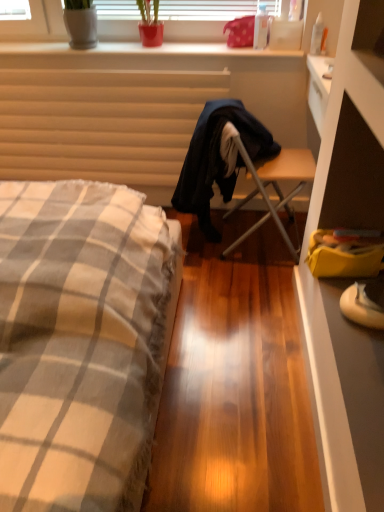
Where is `green matte plant at upper center`? green matte plant at upper center is located at coordinates (206, 9).

Locate an element on the screen. yellow fabric bag at lower right is located at coordinates (344, 255).

The width and height of the screenshot is (384, 512). I want to click on transparent plastic bottle at upper right, marked as the first bottle in a right-to-left arrangement, so click(x=317, y=35).

Find the location of a particular element. The image size is (384, 512). transparent plastic bottle at upper center, the second bottle viewed from the right is located at coordinates (261, 27).

The height and width of the screenshot is (512, 384). What do you see at coordinates (273, 186) in the screenshot?
I see `wooden folding chair at center` at bounding box center [273, 186].

Describe the element at coordinates (364, 304) in the screenshot. This screenshot has height=512, width=384. I see `white suede sneakers at lower right` at that location.

The height and width of the screenshot is (512, 384). In order to click on green matte plant at upper center in this screenshot , I will do `click(206, 9)`.

From a real-world perspective, is green matte plant at upper center positioned above or below transparent plastic bottle at upper right, positioned as the second bottle in left-to-right order?

Clearly, from a real-world perspective, green matte plant at upper center is above transparent plastic bottle at upper right, positioned as the second bottle in left-to-right order.

From the image's perspective, does green matte plant at upper center appear lower than transparent plastic bottle at upper right, positioned as the second bottle in left-to-right order?

No, from the image's perspective, green matte plant at upper center is not beneath transparent plastic bottle at upper right, positioned as the second bottle in left-to-right order.

Who is shorter, green matte plant at upper center or transparent plastic bottle at upper right, marked as the first bottle in a right-to-left arrangement?

With less height is green matte plant at upper center.

From a real-world perspective, which bottle is the 2nd one underneath the green matte plant at upper center? Please provide its 2D coordinates.

[(317, 35)]

Choose the correct answer: Is transparent plastic bottle at upper right, positioned as the second bottle in left-to-right order, inside dark blue fabric robe at center or outside it?

The correct answer is: outside.

Who is smaller, transparent plastic bottle at upper right, marked as the first bottle in a right-to-left arrangement, or dark blue fabric robe at center?

Smaller between the two is transparent plastic bottle at upper right, marked as the first bottle in a right-to-left arrangement.

Considering the relative sizes of transparent plastic bottle at upper right, marked as the first bottle in a right-to-left arrangement, and dark blue fabric robe at center in the image provided, is transparent plastic bottle at upper right, marked as the first bottle in a right-to-left arrangement, shorter than dark blue fabric robe at center?

Yes, transparent plastic bottle at upper right, marked as the first bottle in a right-to-left arrangement, is shorter than dark blue fabric robe at center.

Can you tell me how much transparent plastic bottle at upper right, positioned as the second bottle in left-to-right order, and dark blue fabric robe at center differ in facing direction?

There is a 180-degree angle between the facing directions of transparent plastic bottle at upper right, positioned as the second bottle in left-to-right order, and dark blue fabric robe at center.

How far apart are dark blue fabric robe at center and checkered fabric bed at left?

A distance of 30.01 inches exists between dark blue fabric robe at center and checkered fabric bed at left.

Considering the relative positions of dark blue fabric robe at center and checkered fabric bed at left in the image provided, is dark blue fabric robe at center in front of checkered fabric bed at left?

No, the depth of dark blue fabric robe at center is greater than that of checkered fabric bed at left.

From a real-world perspective, is dark blue fabric robe at center physically below checkered fabric bed at left?

Yes, from a real-world perspective, dark blue fabric robe at center is under checkered fabric bed at left.

Could you tell me if dark blue fabric robe at center is facing checkered fabric bed at left?

No.

Is yellow fabric bag at lower right facing away from transparent plastic bottle at upper center, which appears as the 1th bottle when viewed from the left?

No, yellow fabric bag at lower right is not facing the opposite direction of transparent plastic bottle at upper center, which appears as the 1th bottle when viewed from the left.

Which is in front, yellow fabric bag at lower right or transparent plastic bottle at upper center, the second bottle viewed from the right?

yellow fabric bag at lower right is in front.

From the image's perspective, which is above, yellow fabric bag at lower right or transparent plastic bottle at upper center, which appears as the 1th bottle when viewed from the left?

transparent plastic bottle at upper center, which appears as the 1th bottle when viewed from the left, from the image's perspective.

Is yellow fabric bag at lower right placed right next to transparent plastic bottle at upper center, the second bottle viewed from the right?

No, yellow fabric bag at lower right is not in contact with transparent plastic bottle at upper center, the second bottle viewed from the right.

At what (x,y) coordinates should I click in order to perform the action: click on chair that appears below the green matte plant at upper center (from a real-world perspective). Please return your answer as a coordinate pair (x, y). The height and width of the screenshot is (512, 384). Looking at the image, I should click on (273, 186).

Based on the photo, is the surface of green matte plant at upper center in direct contact with wooden folding chair at center?

No, green matte plant at upper center is not making contact with wooden folding chair at center.

Does green matte plant at upper center appear on the right side of wooden folding chair at center?

No, green matte plant at upper center is not to the right of wooden folding chair at center.

From their relative heights in the image, would you say green matte plant at upper center is taller or shorter than wooden folding chair at center?

green matte plant at upper center is shorter than wooden folding chair at center.

Can you tell me how much transparent plastic bottle at upper right, positioned as the second bottle in left-to-right order, and wooden folding chair at center differ in facing direction?

transparent plastic bottle at upper right, positioned as the second bottle in left-to-right order, and wooden folding chair at center are facing 180 degrees away from each other.

In the scene shown: Is transparent plastic bottle at upper right, positioned as the second bottle in left-to-right order, directly adjacent to wooden folding chair at center?

No.

From the image's perspective, is transparent plastic bottle at upper right, positioned as the second bottle in left-to-right order, on wooden folding chair at center?

Indeed, from the image's perspective, transparent plastic bottle at upper right, positioned as the second bottle in left-to-right order, is shown above wooden folding chair at center.

Is transparent plastic bottle at upper right, positioned as the second bottle in left-to-right order, smaller than wooden folding chair at center?

Yes.

What's the angular difference between transparent plastic bottle at upper center, the second bottle viewed from the right, and yellow fabric bag at lower right's facing directions?

transparent plastic bottle at upper center, the second bottle viewed from the right, and yellow fabric bag at lower right are facing 94.4 degrees away from each other.

Can you confirm if transparent plastic bottle at upper center, which appears as the 1th bottle when viewed from the left, is shorter than yellow fabric bag at lower right?

Incorrect, the height of transparent plastic bottle at upper center, which appears as the 1th bottle when viewed from the left, does not fall short of that of yellow fabric bag at lower right.

Could yellow fabric bag at lower right be considered to be inside transparent plastic bottle at upper center, which appears as the 1th bottle when viewed from the left?

No, yellow fabric bag at lower right is not inside transparent plastic bottle at upper center, which appears as the 1th bottle when viewed from the left.

Which is in front, transparent plastic bottle at upper center, the second bottle viewed from the right, or yellow fabric bag at lower right?

yellow fabric bag at lower right is closer to the camera.

Identify the location of bay window that appears above the transparent plastic bottle at upper right, marked as the first bottle in a right-to-left arrangement (from a real-world perspective). (206, 9).

Locate an element on the screen. robe that is on the left side of transparent plastic bottle at upper right, positioned as the second bottle in left-to-right order is located at coordinates (217, 159).

Estimate the real-world distances between objects in this image. Which object is closer to green matte plant at upper center, transparent plastic bottle at upper right, marked as the first bottle in a right-to-left arrangement, or dark blue fabric robe at center?

transparent plastic bottle at upper right, marked as the first bottle in a right-to-left arrangement, lies closer to green matte plant at upper center than the other object.

From the image, which object appears to be farther from yellow fabric bag at lower right, matte beige radiator at upper left or smooth white surface at upper center?

matte beige radiator at upper left is further to yellow fabric bag at lower right.

From the image, which object appears to be nearer to matte beige radiator at upper left, white suede sneakers at lower right or checkered fabric bed at left?

Among the two, checkered fabric bed at left is located nearer to matte beige radiator at upper left.

Which object lies nearer to the anchor point dark blue fabric robe at center, checkered fabric bed at left or matte beige radiator at upper left?

The object closer to dark blue fabric robe at center is matte beige radiator at upper left.

Looking at the image, which one is located further to wooden folding chair at center, transparent plastic bottle at upper center, the second bottle viewed from the right, or checkered fabric bed at left?

Based on the image, checkered fabric bed at left appears to be further to wooden folding chair at center.

Looking at the image, which one is located further to green matte plant at upper center, transparent plastic bottle at upper right, marked as the first bottle in a right-to-left arrangement, or yellow fabric bag at lower right?

yellow fabric bag at lower right is further to green matte plant at upper center.

Which object lies further to the anchor point smooth white surface at upper center, yellow fabric bag at lower right or transparent plastic bottle at upper center, the second bottle viewed from the right?

Based on the image, yellow fabric bag at lower right appears to be further to smooth white surface at upper center.

Considering their positions, is wooden folding chair at center positioned further to dark blue fabric robe at center than transparent plastic bottle at upper center, the second bottle viewed from the right?

The object further to dark blue fabric robe at center is transparent plastic bottle at upper center, the second bottle viewed from the right.

Where is `robe between matte beige radiator at upper left and transparent plastic bottle at upper center, which appears as the 1th bottle when viewed from the left, from left to right`? This screenshot has width=384, height=512. robe between matte beige radiator at upper left and transparent plastic bottle at upper center, which appears as the 1th bottle when viewed from the left, from left to right is located at coordinates (217, 159).

This screenshot has height=512, width=384. Find the location of `handbag between wooden folding chair at center and white suede sneakers at lower right from top to bottom`. handbag between wooden folding chair at center and white suede sneakers at lower right from top to bottom is located at coordinates (344, 255).

I want to click on chair situated between matte beige radiator at upper left and white suede sneakers at lower right from left to right, so click(x=273, y=186).

At what (x,y) coordinates should I click in order to perform the action: click on chair between smooth white surface at upper center and white suede sneakers at lower right in the vertical direction. Please return your answer as a coordinate pair (x, y). This screenshot has height=512, width=384. Looking at the image, I should click on (273, 186).